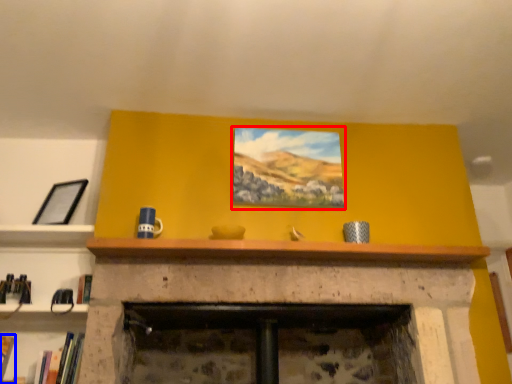
Question: Which point is closer to the camera, picture frame (highlighted by a red box) or book (highlighted by a blue box)?

Choices:
 (A) picture frame
 (B) book

Answer: (B)